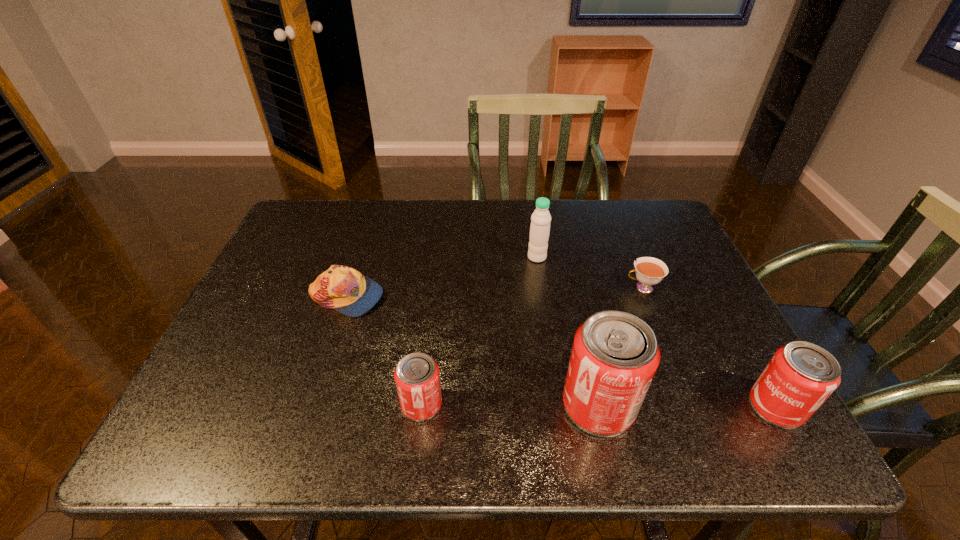
The image size is (960, 540). Find the location of `vacant space that's between the teacup and the second tallest can`. vacant space that's between the teacup and the second tallest can is located at coordinates (709, 347).

The height and width of the screenshot is (540, 960). In order to click on vacant area that lies between the water bottle and the second can from left to right in this screenshot , I will do `click(567, 332)`.

Where is `empty space that is in between the second object from right to left and the rightmost object`? The width and height of the screenshot is (960, 540). empty space that is in between the second object from right to left and the rightmost object is located at coordinates (x=709, y=347).

Where is `vacant area between the teacup and the rightmost can`? vacant area between the teacup and the rightmost can is located at coordinates (709, 347).

Locate an element on the screen. The image size is (960, 540). unoccupied area between the leftmost object and the tallest can is located at coordinates (472, 351).

Where is `the fourth closest object to the second can from left to right`? the fourth closest object to the second can from left to right is located at coordinates (540, 220).

Find the location of a particular element. The height and width of the screenshot is (540, 960). object that is the fourth closest to the leftmost object is located at coordinates (649, 271).

Identify which can is located as the second nearest to the fifth object from left to right. Please provide its 2D coordinates. Your answer should be formatted as a tuple, i.e. [(x, y)], where the tuple contains the x and y coordinates of a point satisfying the conditions above.

[(800, 376)]

Find the location of `can that can be found as the closest to the leftmost can`. can that can be found as the closest to the leftmost can is located at coordinates (615, 355).

What are the coordinates of `free location that satisfies the following two spatial constraints: 1. on the front side of the rightmost can; 2. on the right side of the second can from right to left` in the screenshot? It's located at (599, 407).